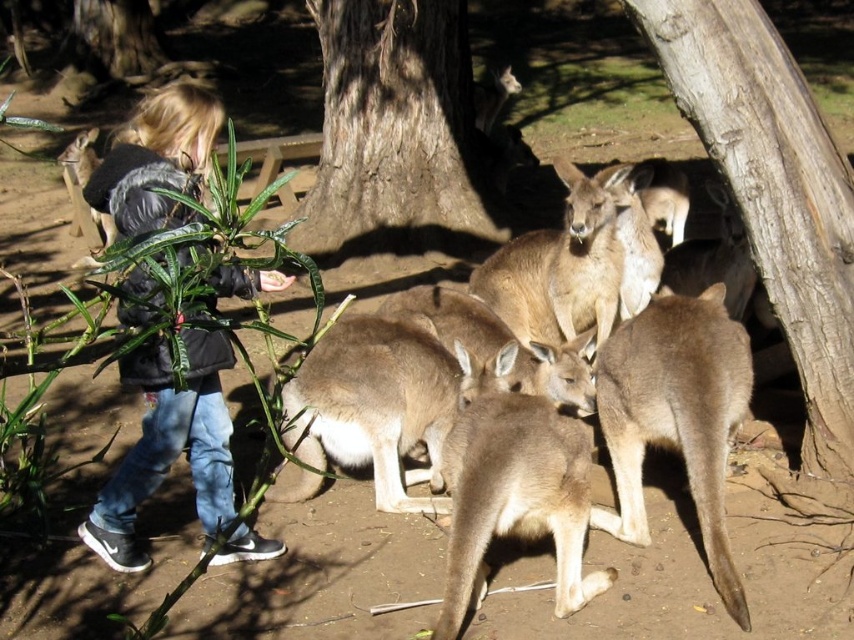
Is point (624, 180) positioned after point (676, 29)?

Yes.

Is light brown fur at center wider than smooth brown bark at upper right?

Correct, the width of light brown fur at center exceeds that of smooth brown bark at upper right.

Does point (336, 412) come farther from viewer compared to point (832, 195)?

Yes.

At what (x,y) coordinates should I click in order to perform the action: click on light brown fur at center. Please return your answer as a coordinate pair (x, y). Looking at the image, I should click on (461, 348).

Find the location of a particular element. This screenshot has width=854, height=640. light brown fur at center is located at coordinates (461, 348).

Where is `light brown fur at center`? light brown fur at center is located at coordinates (461, 348).

This screenshot has height=640, width=854. I want to click on light brown fur at center, so click(x=461, y=348).

Does smooth brown bark at upper right have a greater width compared to brown rough bark tree at center?

Incorrect, smooth brown bark at upper right's width does not surpass brown rough bark tree at center's.

At what (x,y) coordinates should I click in order to perform the action: click on smooth brown bark at upper right. Please return your answer as a coordinate pair (x, y). The height and width of the screenshot is (640, 854). Looking at the image, I should click on (773, 189).

Which is in front, point (761, 241) or point (390, 134)?

Point (761, 241)

Where is `smooth brown bark at upper right`? This screenshot has width=854, height=640. smooth brown bark at upper right is located at coordinates pos(773,189).